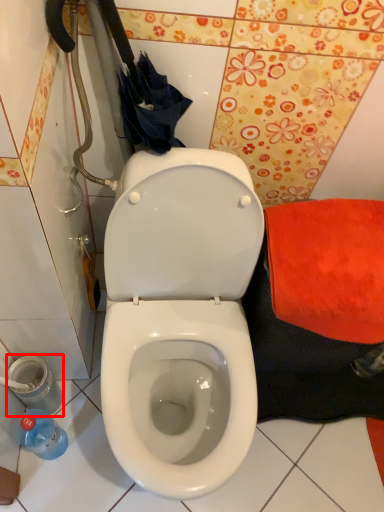
Question: From the image's perspective, where is potty (annotated by the red box) located relative to bottle?

Choices:
 (A) above
 (B) below

Answer: (A)